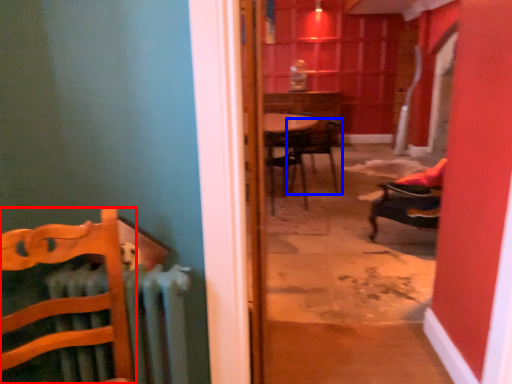
Question: Among these objects, which one is farthest to the camera, chair (highlighted by a red box) or chair (highlighted by a blue box)?

Choices:
 (A) chair
 (B) chair

Answer: (B)